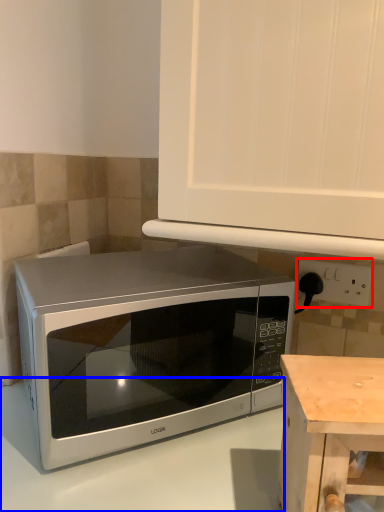
Question: Which of the following is the farthest to the observer, electric outlet (highlighted by a red box) or counter top (highlighted by a blue box)?

Choices:
 (A) electric outlet
 (B) counter top

Answer: (A)